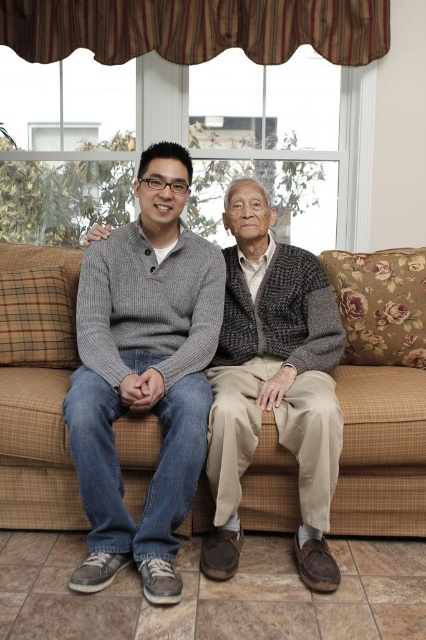
Which is in front, point (259, 289) or point (8, 448)?

Positioned in front is point (8, 448).

The width and height of the screenshot is (426, 640). Find the location of `gray knitted sweater at center`. gray knitted sweater at center is located at coordinates (273, 381).

Between point (282, 442) and point (69, 250), which one is positioned in front?

Point (282, 442) is more forward.

Locate an element on the screen. gray knitted sweater at center is located at coordinates point(273,381).

Looking at this image, is gray knitted sweater at center bigger than knit sweater at center?

Correct, gray knitted sweater at center is larger in size than knit sweater at center.

In the scene shown: Is gray knitted sweater at center wider than knit sweater at center?

Yes.

Describe the element at coordinates (273, 381) in the screenshot. I see `gray knitted sweater at center` at that location.

At what (x,y) coordinates should I click in order to perform the action: click on gray knitted sweater at center. Please return your answer as a coordinate pair (x, y). This screenshot has width=426, height=640. Looking at the image, I should click on (273, 381).

Does brown plaid couch at center lie behind knit sweater at center?

Yes.

Which of these two, brown plaid couch at center or knit sweater at center, stands taller?

knit sweater at center is taller.

Locate an element on the screen. brown plaid couch at center is located at coordinates (380, 452).